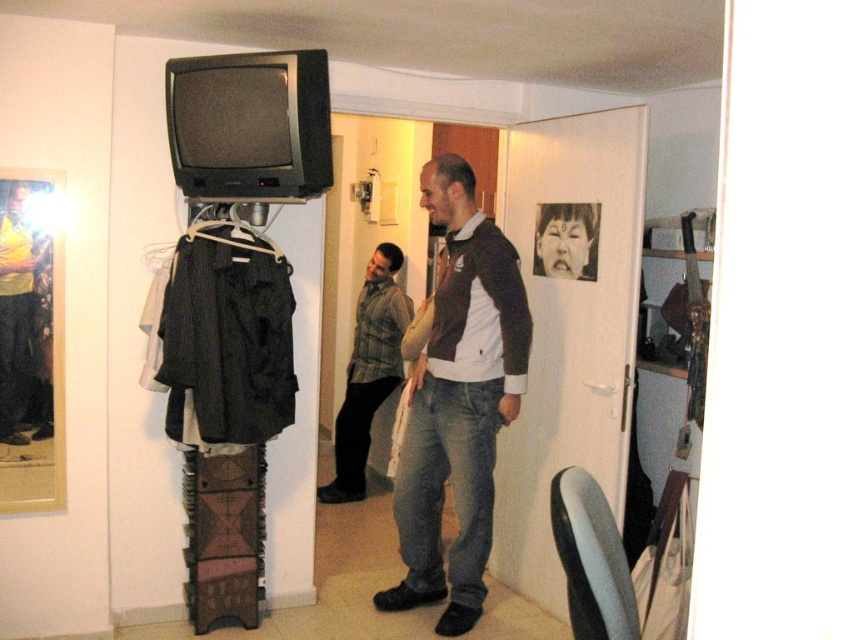
Question: Does brown/white sweater at center appear over plaid fabric shirt at center?

Choices:
 (A) no
 (B) yes

Answer: (B)

Question: Can you confirm if black fabric hanger at left is positioned above smooth black face at upper center?

Choices:
 (A) yes
 (B) no

Answer: (B)

Question: Which point is closer to the camera?

Choices:
 (A) yellow matte shirt at left
 (B) brown/white sweater at center
 (C) plaid fabric shirt at center
 (D) smooth black face at upper center

Answer: (A)

Question: Where is plaid fabric shirt at center located in relation to smooth black face at upper center in the image?

Choices:
 (A) above
 (B) below

Answer: (B)

Question: Which object appears farthest from the camera in this image?

Choices:
 (A) plaid fabric shirt at center
 (B) black fabric hanger at left
 (C) smooth black face at upper center
 (D) brown/white sweater at center

Answer: (A)

Question: Estimate the real-world distances between objects in this image. Which object is closer to the yellow matte shirt at left?

Choices:
 (A) plaid fabric shirt at center
 (B) brown/white sweater at center
 (C) smooth black face at upper center

Answer: (B)